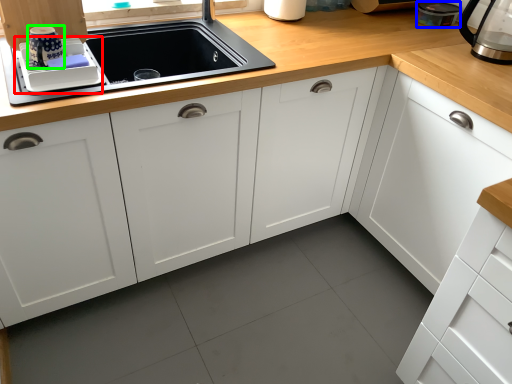
Question: Considering the real-world distances, which object is farthest from appliance (highlighted by a red box)? appliance (highlighted by a blue box) or appliance (highlighted by a green box)?

Choices:
 (A) appliance
 (B) appliance

Answer: (A)